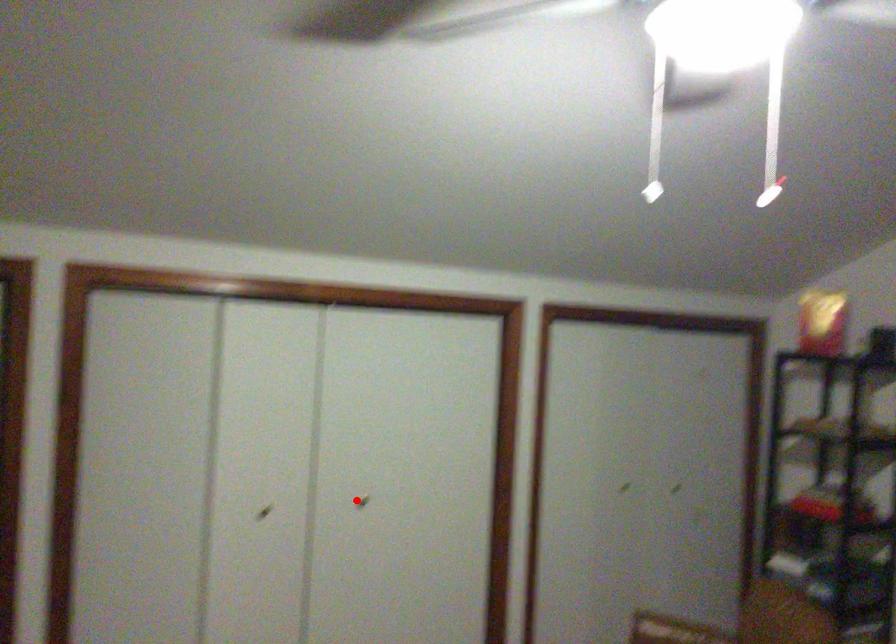
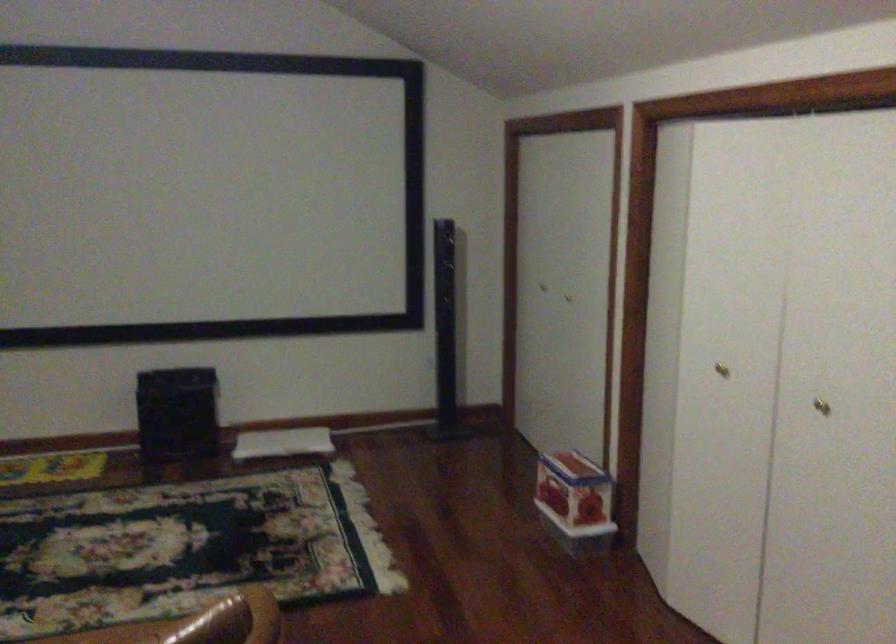
Where in the second image is the point corresponding to the highlighted location from the first image?

(821, 406)